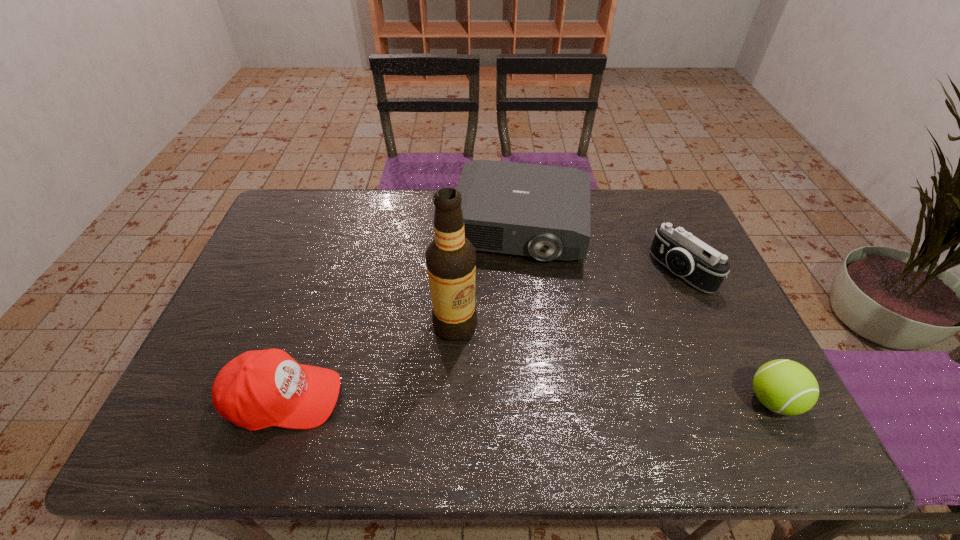
Image resolution: width=960 pixels, height=540 pixels. Find the location of `the leftmost object`. the leftmost object is located at coordinates (258, 389).

The height and width of the screenshot is (540, 960). I want to click on tennis ball, so click(x=786, y=387).

The image size is (960, 540). Identify the location of projector. (542, 211).

Where is `camera`? Image resolution: width=960 pixels, height=540 pixels. camera is located at coordinates (700, 265).

Where is `the third nearest object`? The height and width of the screenshot is (540, 960). the third nearest object is located at coordinates (451, 258).

This screenshot has height=540, width=960. Identify the location of alcohol. (451, 258).

Find the location of a particular element. This screenshot has height=540, width=960. free space located 0.140m on the front panel of the baseball cap is located at coordinates (401, 398).

Identify the location of free point located 0.280m on the back of the tennis ball. Image resolution: width=960 pixels, height=540 pixels. (717, 292).

Locate an element on the screen. vacant space located 0.140m on the front-facing side of the projector is located at coordinates (504, 301).

Image resolution: width=960 pixels, height=540 pixels. Find the location of `free space located on the front-facing side of the projector`. free space located on the front-facing side of the projector is located at coordinates (508, 281).